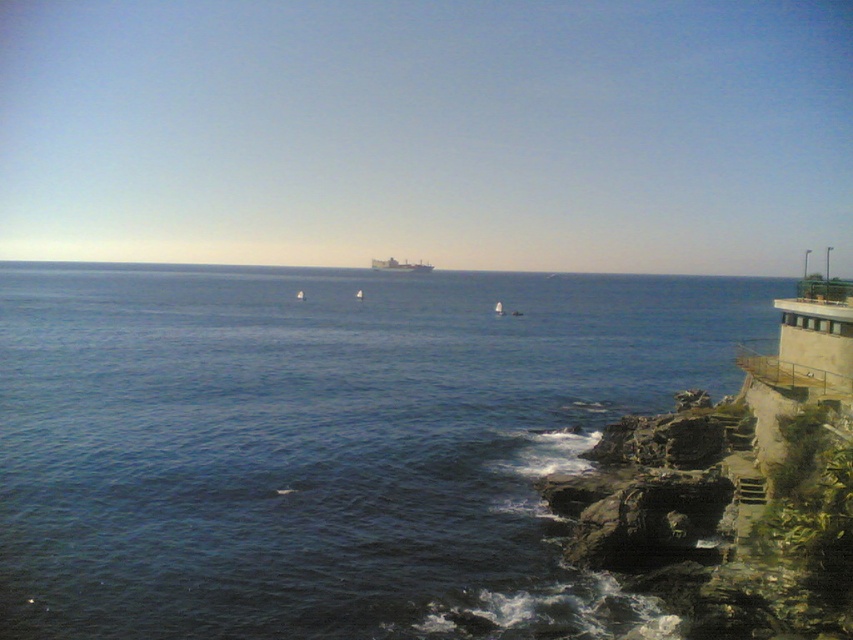
You are standing at the point marked as point (326, 444) in the lower left of the image. Looking towards the larger ship on the horizon, which direction should you face?

You should face towards the upper right direction because the larger ship on the horizon is located in the upper right relative to the point (326, 444).

You are an observer standing at the origin point of the image coordinate system. You see the blue water at lower left. What are the coordinates of its 2D location?

The coordinates of the 2D location of the blue water at lower left are at point (326, 444).

You are a sailor trying to navigate your boat to the metallic gray ship at center. From your current position near the blue water at lower left, in which direction should you sail to reach the ship?

The blue water at lower left is positioned under the metallic gray ship at center, so you should sail upwards from the blue water at lower left to reach the metallic gray ship at center.